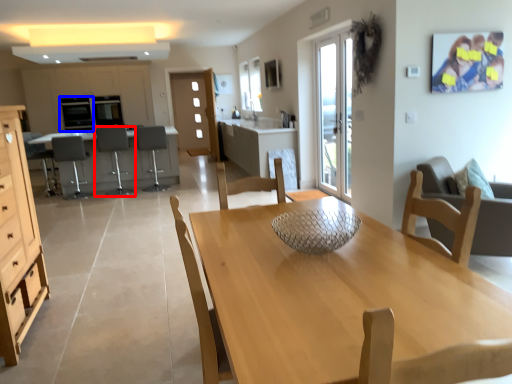
Question: Among these objects, which one is nearest to the camera, chair (highlighted by a red box) or appliance (highlighted by a blue box)?

Choices:
 (A) chair
 (B) appliance

Answer: (A)